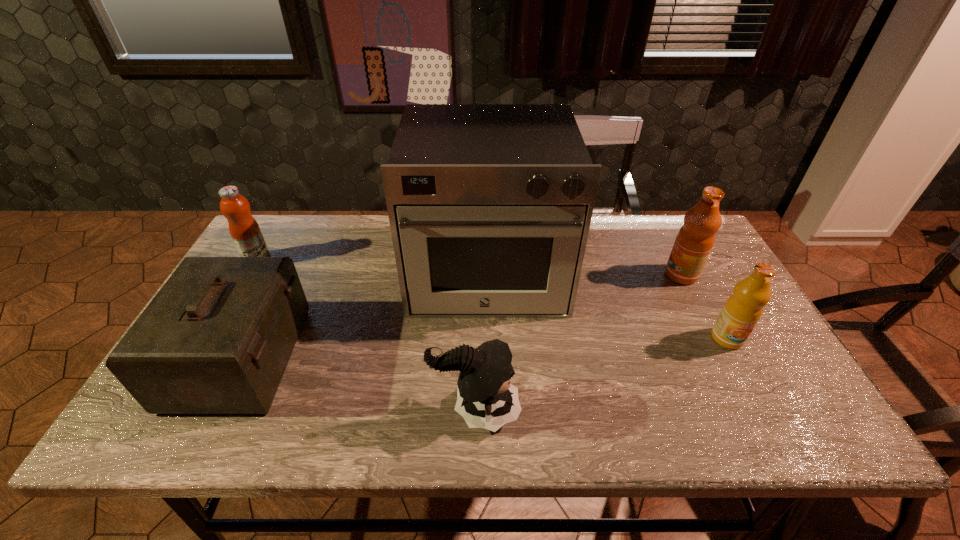
Find the location of a particular element. toaster oven is located at coordinates (490, 205).

You are a GUI agent. You are given a task and a screenshot of the screen. Output one action in this format:
    pyautogui.click(x=<x>, y=<y>)
    Task: Click on the leftmost fruit juice
    
    Given the screenshot: What is the action you would take?
    pyautogui.click(x=244, y=229)

The width and height of the screenshot is (960, 540). What are the coordinates of `the nearest fruit juice` in the screenshot? It's located at (743, 309).

Where is `the first-aid kit`? This screenshot has height=540, width=960. the first-aid kit is located at coordinates (216, 339).

Identify the location of doll. (x=485, y=398).

The height and width of the screenshot is (540, 960). In order to click on free space located 0.100m on the front panel of the toaster oven in this screenshot , I will do `click(489, 356)`.

At what (x,y) coordinates should I click in order to perform the action: click on free space located 0.300m on the front label of the leftmost fruit juice. Please return your answer as a coordinate pair (x, y). Looking at the image, I should click on (369, 260).

The image size is (960, 540). I want to click on free space located on the front label of the nearest fruit juice, so pyautogui.click(x=772, y=421).

This screenshot has height=540, width=960. I want to click on vacant space situated 0.240m on the back of the first-aid kit, so (292, 255).

The height and width of the screenshot is (540, 960). What are the coordinates of `free spot located 0.380m at the face of the doll` in the screenshot? It's located at click(694, 410).